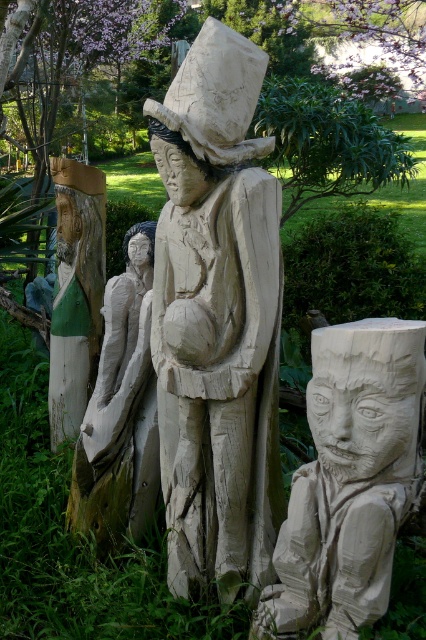
Question: Can you confirm if natural wood statue at center is wider than carved wood face at lower right?

Choices:
 (A) no
 (B) yes

Answer: (A)

Question: Considering the real-world distances, which object is farthest from the natural wood statue at center?

Choices:
 (A) natural wood carving at center
 (B) carved wood face at lower right

Answer: (A)

Question: Can you confirm if natural wood statue at center is wider than carved wood face at lower right?

Choices:
 (A) no
 (B) yes

Answer: (A)

Question: Can you confirm if carved wood face at lower right is positioned above natural wood carving at center?

Choices:
 (A) yes
 (B) no

Answer: (B)

Question: Which of the following is the farthest from the observer?

Choices:
 (A) natural wood statue at center
 (B) carved wood face at lower right
 (C) natural wood carving at center

Answer: (C)

Question: Which of the following is the closest to the observer?

Choices:
 (A) (296, 609)
 (B) (132, 412)
 (C) (215, 474)

Answer: (A)